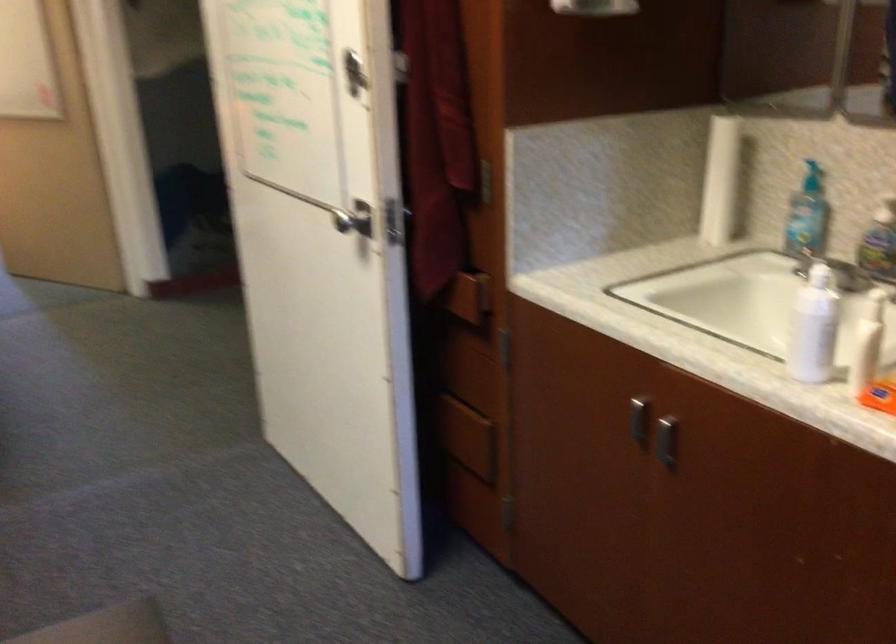
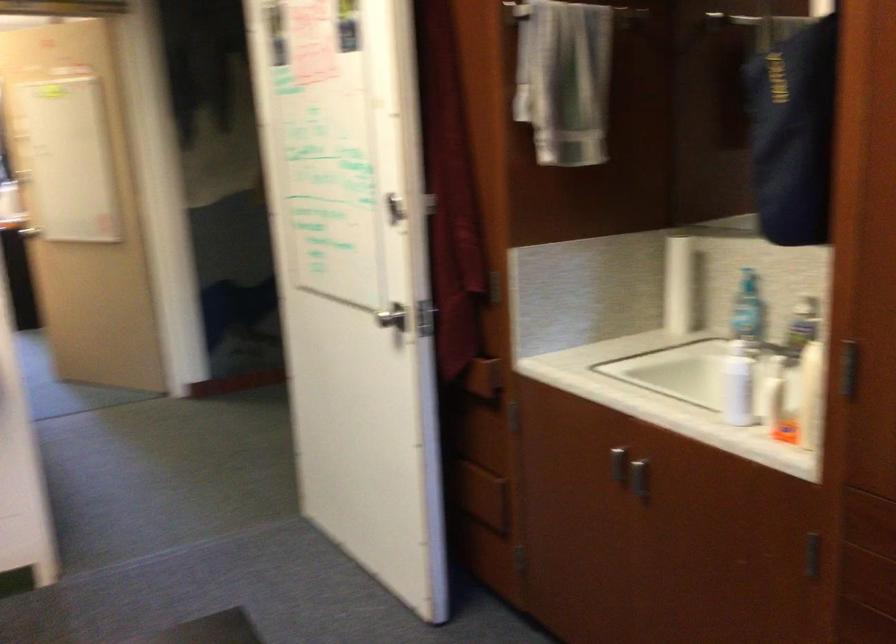
Question: The first image is from the beginning of the video and the second image is from the end. How did the camera likely rotate when shooting the video?

Choices:
 (A) Left
 (B) Right
 (C) Up
 (D) Down

Answer: (C)